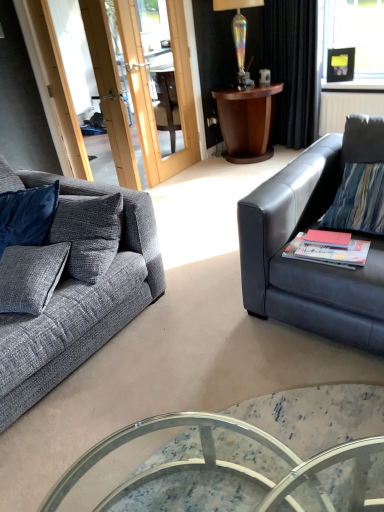
Question: Is dark wood side table at upper center wider or thinner than marble glass coffee table at center?

Choices:
 (A) wide
 (B) thin

Answer: (B)

Question: From the image's perspective, is dark wood side table at upper center located above or below marble glass coffee table at center?

Choices:
 (A) above
 (B) below

Answer: (A)

Question: Which object is positioned farthest from the iridescent glass lamp at upper center?

Choices:
 (A) matte red book at right, the first book in the right-to-left sequence
 (B) marble glass coffee table at center
 (C) matte white coffee cup at upper center
 (D) black velvet curtain at upper right
 (E) matte black couch at right, positioned as the second studio couch in left-to-right order

Answer: (B)

Question: Which object is the closest to the matte white coffee cup at upper center?

Choices:
 (A) black velvet curtain at upper right
 (B) matte red book at right, acting as the second book starting from the right
 (C) marble glass coffee table at center
 (D) dark wood side table at upper center
 (E) iridescent glass lamp at upper center

Answer: (A)